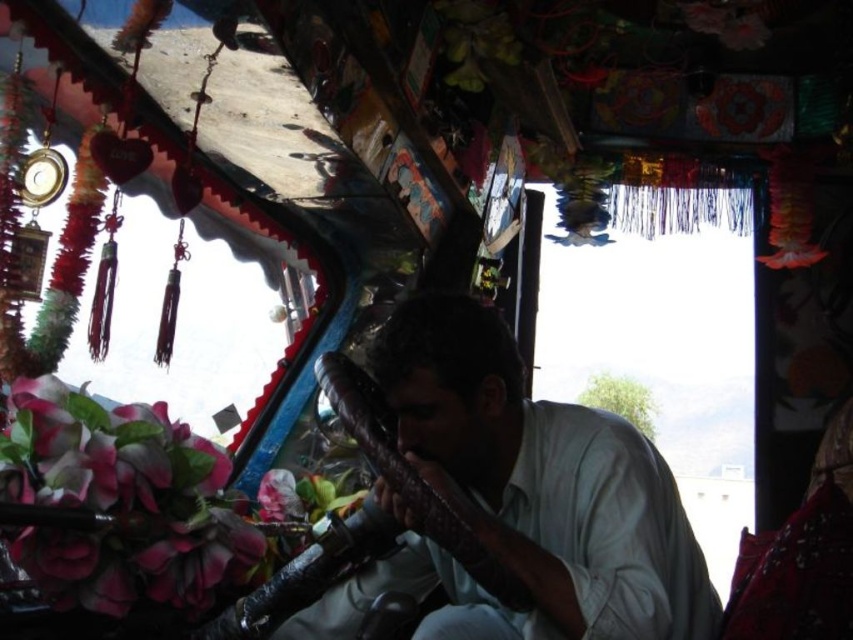
Measure the distance between matte brown instrument at center and pink silk flower at lower left.

matte brown instrument at center and pink silk flower at lower left are 58.28 centimeters apart.

Does matte brown instrument at center lie in front of pink silk flower at lower left?

No.

The image size is (853, 640). Identify the location of matte brown instrument at center. (521, 497).